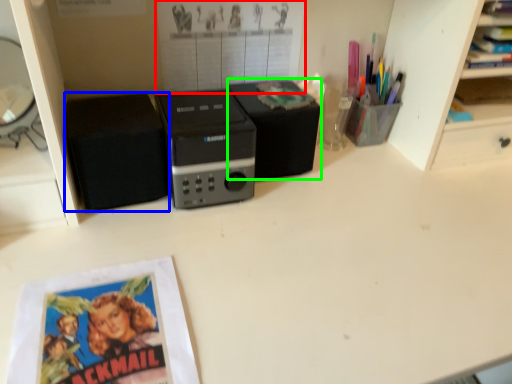
Question: Which object is positioned farthest from poster page (highlighted by a red box)? Select from speaker (highlighted by a blue box) and speaker (highlighted by a green box).

Choices:
 (A) speaker
 (B) speaker

Answer: (A)